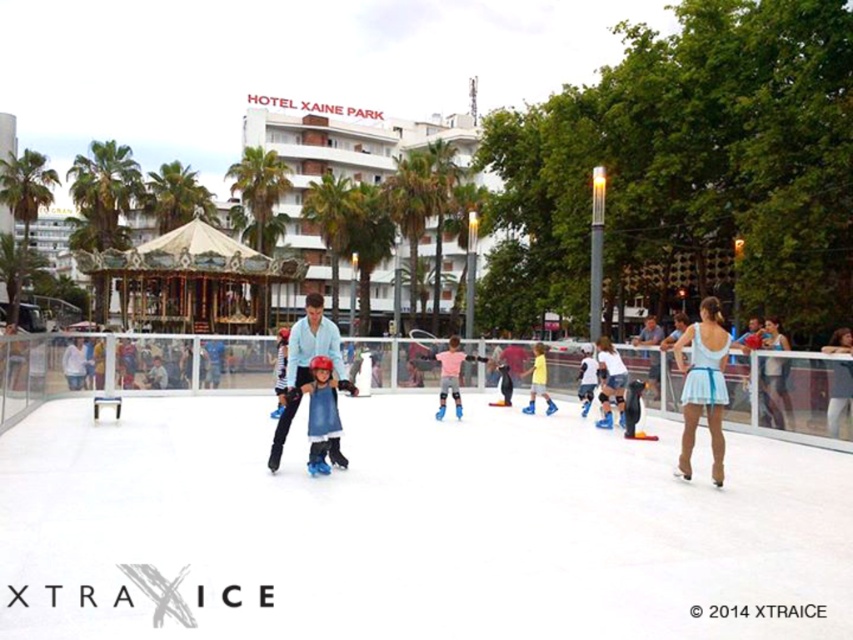
Is light blue fabric dress at center below blue fabric dress at center?

No.

Can you confirm if light blue fabric dress at center is shorter than blue fabric dress at center?

Incorrect, light blue fabric dress at center's height does not fall short of blue fabric dress at center's.

The image size is (853, 640). I want to click on light blue fabric dress at center, so click(839, 396).

Who is more forward, [155,596] or [544,387]?

Positioned in front is point [155,596].

Who is lower down, white smooth ice at center or yellow matte skates at center?

Positioned lower is white smooth ice at center.

Who is more distant from viewer, (56, 476) or (537, 353)?

The point (537, 353) is behind.

Where is `white smooth ice at center`? The height and width of the screenshot is (640, 853). white smooth ice at center is located at coordinates (410, 529).

Locate an element on the screen. The image size is (853, 640). light blue satin dress at center is located at coordinates (703, 385).

Can you confirm if light blue satin dress at center is wider than blue denim jacket at center?

Yes, light blue satin dress at center is wider than blue denim jacket at center.

The image size is (853, 640). What do you see at coordinates (703, 385) in the screenshot?
I see `light blue satin dress at center` at bounding box center [703, 385].

Image resolution: width=853 pixels, height=640 pixels. I want to click on light blue satin dress at center, so click(x=703, y=385).